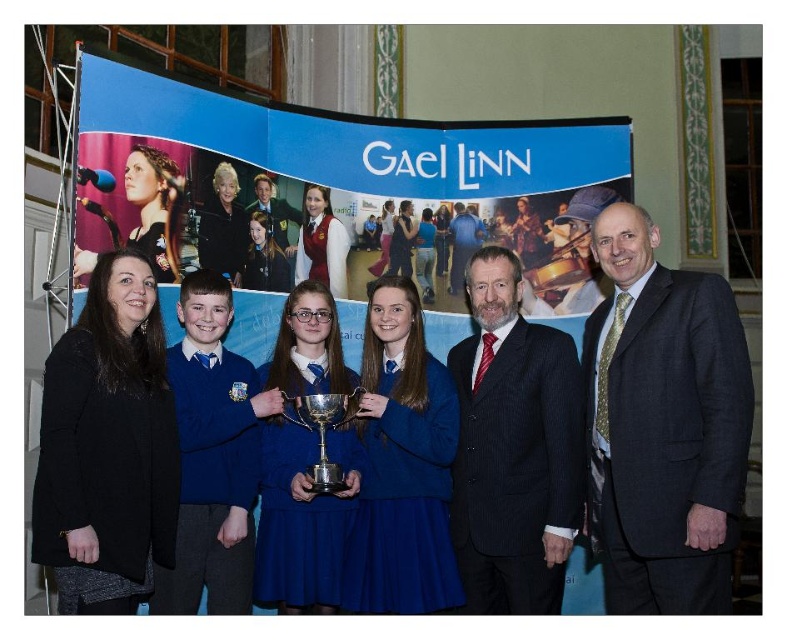
You are a photographer who needs to adjust the lighting to ensure both the blue fabric dress at center and the dark suit at center are evenly lit. Considering their height difference, which one might require a higher light stand to achieve proper lighting?

The blue fabric dress at center is much taller than the dark suit at center, so the higher light stand should be positioned above the blue fabric dress at center to ensure even lighting.

You are a photographer standing at the center of the scene. You want to take a closeup shot of the dark gray suit at right and the blue fabric dress at center. Given that your camera has a maximum zoom range of 10 meters, will you be able to focus on both subjects simultaneously?

The dark gray suit at right is 12.83 meters from the blue fabric dress at center, which exceeds the camera maximum zoom range of 10 meters. Therefore, you cannot focus on both subjects simultaneously.